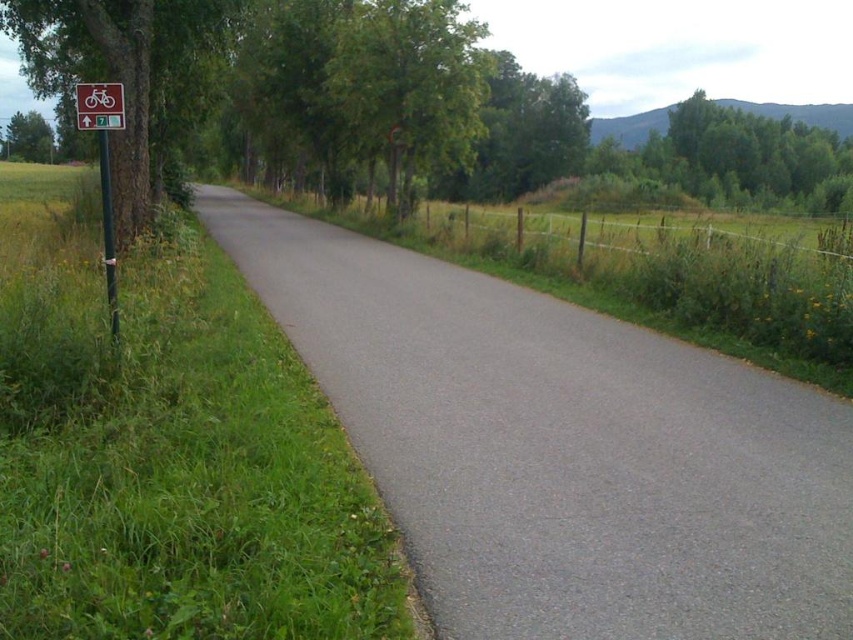
Can you confirm if gray asphalt road at center is bigger than white plastic bicycle sign at upper left?

Indeed, gray asphalt road at center has a larger size compared to white plastic bicycle sign at upper left.

Where is `gray asphalt road at center`? This screenshot has height=640, width=853. gray asphalt road at center is located at coordinates (560, 448).

The height and width of the screenshot is (640, 853). In order to click on gray asphalt road at center in this screenshot , I will do point(560,448).

Find the location of `green leafy tree at left`. green leafy tree at left is located at coordinates (123, 72).

Is green leafy tree at left shorter than red plastic sign at left?

In fact, green leafy tree at left may be taller than red plastic sign at left.

This screenshot has height=640, width=853. In order to click on green leafy tree at left in this screenshot , I will do `click(123, 72)`.

Can you confirm if green leafy tree at left is wider than green metallic pole at left?

Indeed, green leafy tree at left has a greater width compared to green metallic pole at left.

Between green leafy tree at left and green metallic pole at left, which one appears on the right side from the viewer's perspective?

Positioned to the right is green metallic pole at left.

Find the location of `green leafy tree at left`. green leafy tree at left is located at coordinates (123, 72).